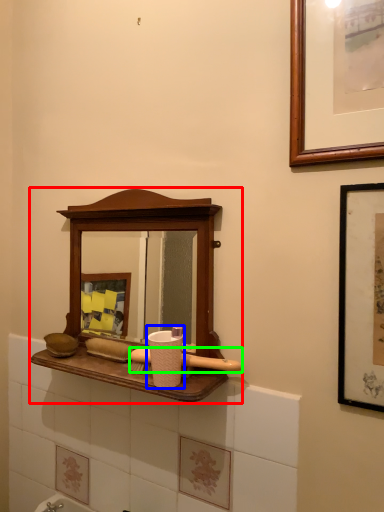
Question: Based on their relative distances, which object is farther from medicine cabinet (highlighted by a red box)? Choose from toiletry (highlighted by a blue box) and brush (highlighted by a green box).

Choices:
 (A) toiletry
 (B) brush

Answer: (B)